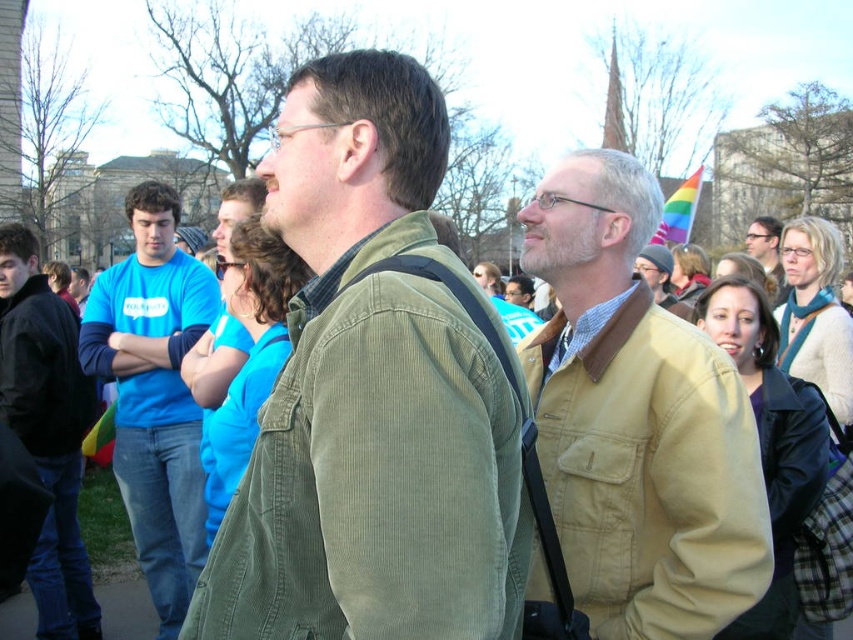
Question: Estimate the real-world distances between objects in this image. Which object is closer to the khaki corduroy jacket at upper right?

Choices:
 (A) matte blue shirt at left
 (B) green corduroy jacket at center

Answer: (B)

Question: Among these objects, which one is nearest to the camera?

Choices:
 (A) blue cotton shirt at left
 (B) green corduroy jacket at center

Answer: (B)

Question: Can you confirm if green corduroy jacket at center is positioned to the right of matte blue shirt at left?

Choices:
 (A) yes
 (B) no

Answer: (A)

Question: Is the position of blue cotton shirt at left more distant than that of light brown leather jacket at center?

Choices:
 (A) no
 (B) yes

Answer: (A)

Question: Can you confirm if green corduroy jacket at center is wider than light brown leather jacket at center?

Choices:
 (A) no
 (B) yes

Answer: (A)

Question: Which object is the farthest from the matte blue shirt at left?

Choices:
 (A) green corduroy jacket at center
 (B) blue cotton shirt at left
 (C) light brown leather jacket at center
 (D) khaki corduroy jacket at upper right

Answer: (C)